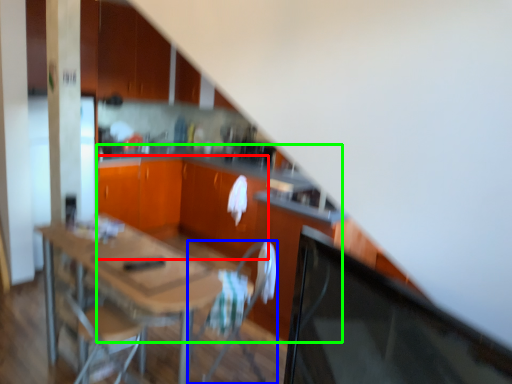
Question: Considering the real-world distances, which object is closest to cabinetry (highlighted by a red box)? chair (highlighted by a blue box) or computer desk (highlighted by a green box).

Choices:
 (A) chair
 (B) computer desk

Answer: (B)